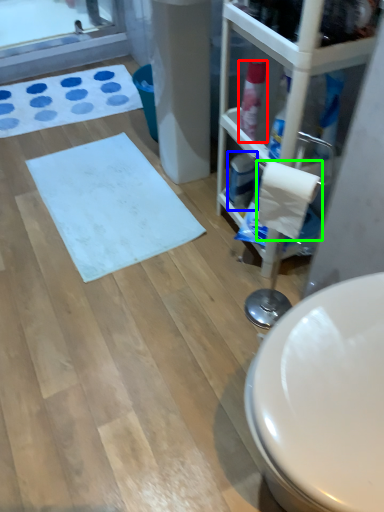
Question: Considering the real-world distances, which object is closest to cleaning product (highlighted by a red box)? cleaning product (highlighted by a blue box) or toilet paper (highlighted by a green box).

Choices:
 (A) cleaning product
 (B) toilet paper

Answer: (A)